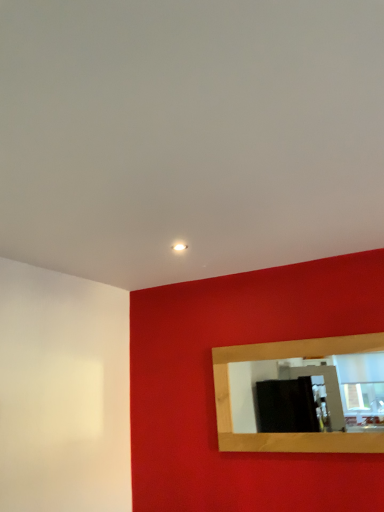
Where is `wooden mirror at lower right`? Image resolution: width=384 pixels, height=512 pixels. wooden mirror at lower right is located at coordinates (315, 387).

What do you see at coordinates (315, 387) in the screenshot? I see `wooden mirror at lower right` at bounding box center [315, 387].

Find the location of `wooden mirror at lower right`. wooden mirror at lower right is located at coordinates (315, 387).